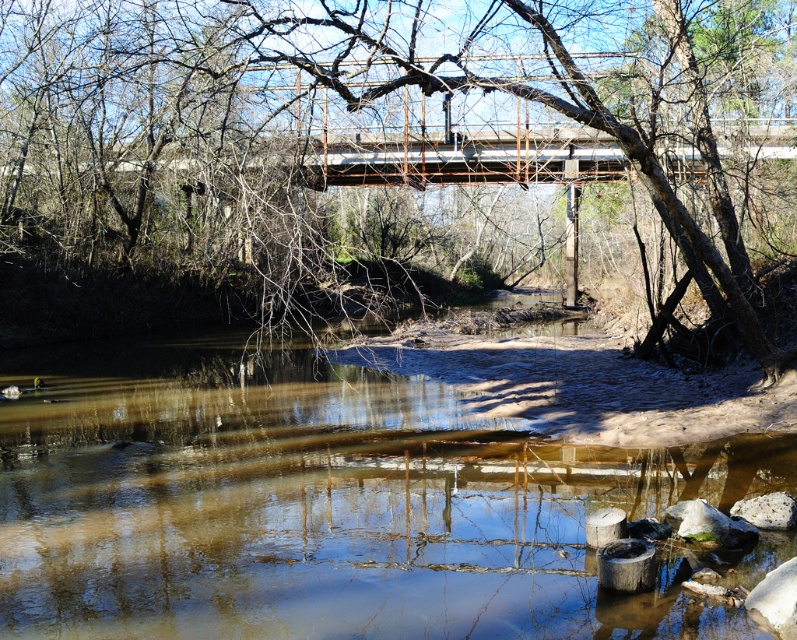
This screenshot has width=797, height=640. Describe the element at coordinates (387, 156) in the screenshot. I see `brown rough tree at upper center` at that location.

Who is shorter, brown rough tree at upper center or brown sedimentary river at center?

With less height is brown sedimentary river at center.

At what (x,y) coordinates should I click in order to perform the action: click on brown rough tree at upper center. Please return your answer as a coordinate pair (x, y). Image resolution: width=797 pixels, height=640 pixels. Looking at the image, I should click on (387, 156).